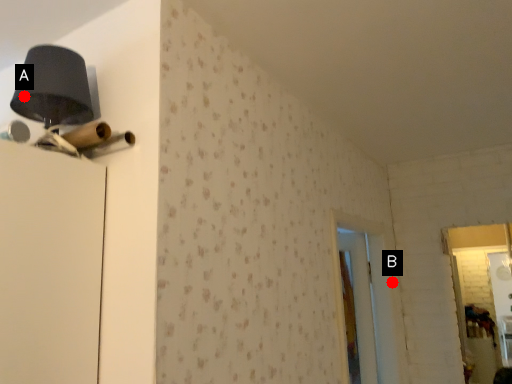
Question: Two points are circled on the image, labeled by A and B beside each circle. Among these points, which one is farthest from the camera?

Choices:
 (A) A is further
 (B) B is further

Answer: (B)